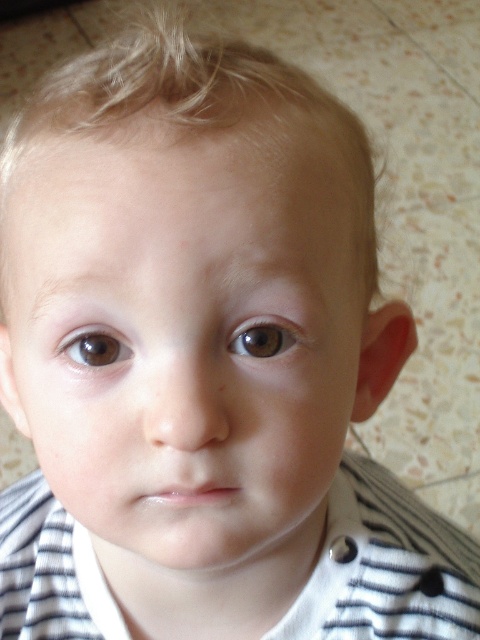
Question: Observing the image, what is the correct spatial positioning of smooth skin face at center in reference to blonde fine hair at upper center?

Choices:
 (A) above
 (B) below

Answer: (B)

Question: Can you confirm if brown matte eye at center is wider than brown matte eye at left?

Choices:
 (A) yes
 (B) no

Answer: (A)

Question: Estimate the real-world distances between objects in this image. Which object is closer to the brown matte eye at left?

Choices:
 (A) blonde fine hair at upper center
 (B) smooth skin face at center
 (C) brown matte eye at center

Answer: (C)

Question: Does brown matte eye at center have a lesser width compared to brown matte eye at left?

Choices:
 (A) yes
 (B) no

Answer: (B)

Question: Among these points, which one is farthest from the camera?

Choices:
 (A) (24, 262)
 (B) (239, 72)

Answer: (A)

Question: Which point is closer to the camera?

Choices:
 (A) smooth skin face at center
 (B) blonde fine hair at upper center
 (C) brown matte eye at center
 (D) brown matte eye at left

Answer: (A)